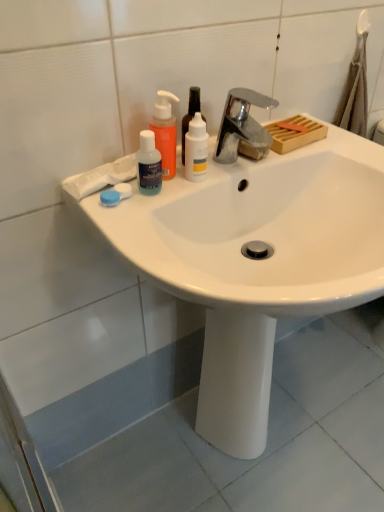
Question: Which direction should I rotate to look at white glossy bottle at center, arranged as the first mouthwash when viewed from the right?

Choices:
 (A) left
 (B) right

Answer: (B)

Question: Is translucent plastic mouthwash at upper left, positioned as the 3th mouthwash in right-to-left order, positioned with its back to white glossy bottle at center, arranged as the first mouthwash when viewed from the right?

Choices:
 (A) no
 (B) yes

Answer: (A)

Question: Does translucent plastic mouthwash at upper left, positioned as the 3th mouthwash in right-to-left order, have a lesser height compared to white glossy bottle at center, the third mouthwash in the left-to-right sequence?

Choices:
 (A) yes
 (B) no

Answer: (A)

Question: Is translucent plastic mouthwash at upper left, arranged as the first mouthwash when viewed from the left, far from white glossy bottle at center, the third mouthwash in the left-to-right sequence?

Choices:
 (A) yes
 (B) no

Answer: (B)

Question: Considering the relative sizes of translucent plastic mouthwash at upper left, arranged as the first mouthwash when viewed from the left, and white glossy bottle at center, the third mouthwash in the left-to-right sequence, in the image provided, is translucent plastic mouthwash at upper left, arranged as the first mouthwash when viewed from the left, wider than white glossy bottle at center, the third mouthwash in the left-to-right sequence,?

Choices:
 (A) no
 (B) yes

Answer: (A)

Question: From the image's perspective, would you say translucent plastic mouthwash at upper left, positioned as the 3th mouthwash in right-to-left order, is positioned over white glossy bottle at center, arranged as the first mouthwash when viewed from the right?

Choices:
 (A) yes
 (B) no

Answer: (B)

Question: Is translucent plastic mouthwash at upper left, arranged as the first mouthwash when viewed from the left, bigger than white glossy bottle at center, the third mouthwash in the left-to-right sequence?

Choices:
 (A) no
 (B) yes

Answer: (A)

Question: Considering the relative positions of translucent orange pump bottle at upper left and translucent plastic mouthwash at upper left, positioned as the 3th mouthwash in right-to-left order, in the image provided, is translucent orange pump bottle at upper left to the left of translucent plastic mouthwash at upper left, positioned as the 3th mouthwash in right-to-left order, from the viewer's perspective?

Choices:
 (A) no
 (B) yes

Answer: (A)

Question: Considering the relative positions of translucent orange pump bottle at upper left and translucent plastic mouthwash at upper left, arranged as the first mouthwash when viewed from the left, in the image provided, is translucent orange pump bottle at upper left to the right of translucent plastic mouthwash at upper left, arranged as the first mouthwash when viewed from the left, from the viewer's perspective?

Choices:
 (A) yes
 (B) no

Answer: (A)

Question: Is translucent orange pump bottle at upper left touching translucent plastic mouthwash at upper left, positioned as the 3th mouthwash in right-to-left order?

Choices:
 (A) yes
 (B) no

Answer: (A)

Question: Considering the relative sizes of translucent orange pump bottle at upper left and translucent plastic mouthwash at upper left, arranged as the first mouthwash when viewed from the left, in the image provided, is translucent orange pump bottle at upper left bigger than translucent plastic mouthwash at upper left, arranged as the first mouthwash when viewed from the left,?

Choices:
 (A) no
 (B) yes

Answer: (B)

Question: Is translucent orange pump bottle at upper left shorter than translucent plastic mouthwash at upper left, arranged as the first mouthwash when viewed from the left?

Choices:
 (A) yes
 (B) no

Answer: (B)

Question: Considering the relative sizes of translucent orange pump bottle at upper left and translucent plastic mouthwash at upper left, arranged as the first mouthwash when viewed from the left, in the image provided, is translucent orange pump bottle at upper left smaller than translucent plastic mouthwash at upper left, arranged as the first mouthwash when viewed from the left,?

Choices:
 (A) yes
 (B) no

Answer: (B)

Question: From the image's perspective, would you say chrome metallic faucet at upper center is shown under blue plastic contact lens case at left?

Choices:
 (A) yes
 (B) no

Answer: (B)